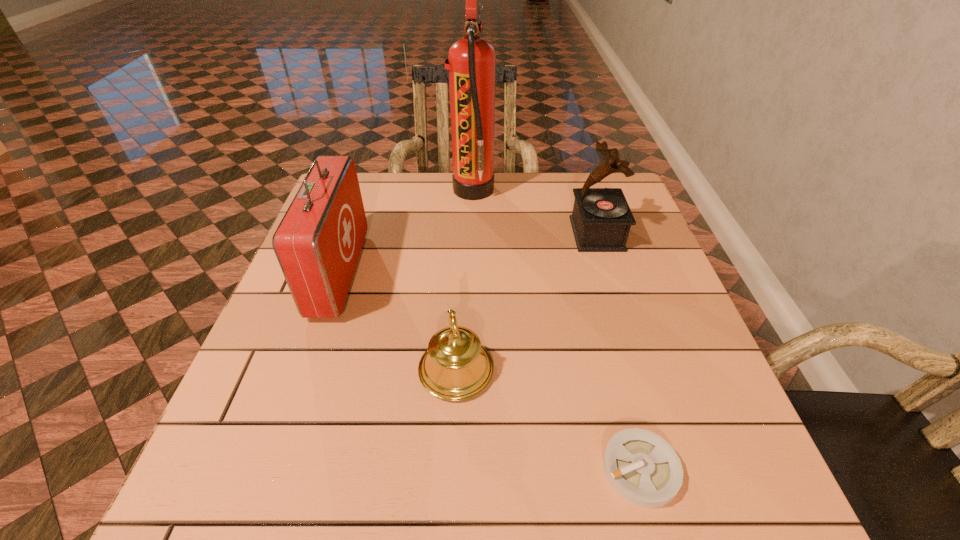
I want to click on empty space between the leftmost object and the phonograph_record, so click(468, 253).

Where is `free space that is in between the phonograph_record and the shortest object`? The height and width of the screenshot is (540, 960). free space that is in between the phonograph_record and the shortest object is located at coordinates (618, 352).

Locate an element on the screen. The image size is (960, 540). vacant space that is in between the phonograph_record and the bell is located at coordinates (526, 302).

The height and width of the screenshot is (540, 960). In order to click on free space between the ashtray and the farthest object in this screenshot , I will do (557, 329).

The width and height of the screenshot is (960, 540). What are the coordinates of `free spot between the fire extinguisher and the nearest object` in the screenshot? It's located at (557, 329).

Where is `free space between the phonograph_record and the leftmost object`? free space between the phonograph_record and the leftmost object is located at coordinates (468, 253).

I want to click on vacant space that is in between the ashtray and the fourth farthest object, so click(x=548, y=420).

Identify which object is the second nearest to the farthest object. Please provide its 2D coordinates. Your answer should be formatted as a tuple, i.e. [(x, y)], where the tuple contains the x and y coordinates of a point satisfying the conditions above.

[(318, 242)]

What are the coordinates of `object that is the third closest one to the phonograph_record` in the screenshot? It's located at (644, 469).

Locate an element on the screen. Image resolution: width=960 pixels, height=540 pixels. blank area in the image that satisfies the following two spatial constraints: 1. with the nozzle pointing from the back of the farthest object; 2. on the left side of the shortest object is located at coordinates (467, 469).